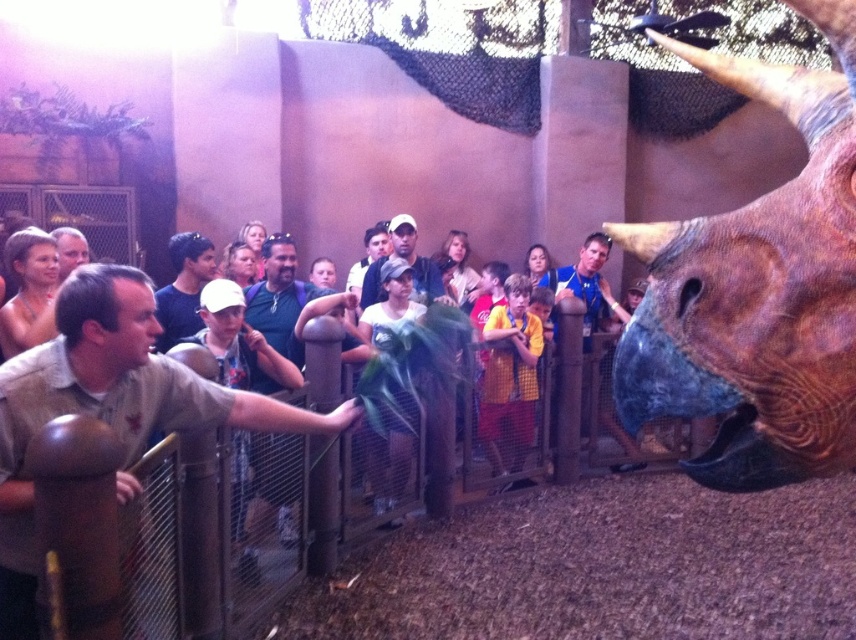
Question: Among these points, which one is farthest from the camera?

Choices:
 (A) (482, 392)
 (B) (813, 237)

Answer: (A)

Question: Which of these objects is positioned closest to the rustic brown horned head at right?

Choices:
 (A) light brown shirt at center
 (B) yellow shirt at center

Answer: (A)

Question: Estimate the real-world distances between objects in this image. Which object is closer to the rustic brown horned head at right?

Choices:
 (A) light brown shirt at center
 (B) yellow shirt at center

Answer: (A)

Question: Does light brown shirt at center appear on the right side of yellow shirt at center?

Choices:
 (A) no
 (B) yes

Answer: (A)

Question: Is rustic brown horned head at right below light brown shirt at center?

Choices:
 (A) yes
 (B) no

Answer: (B)

Question: Is light brown shirt at center positioned before yellow shirt at center?

Choices:
 (A) yes
 (B) no

Answer: (A)